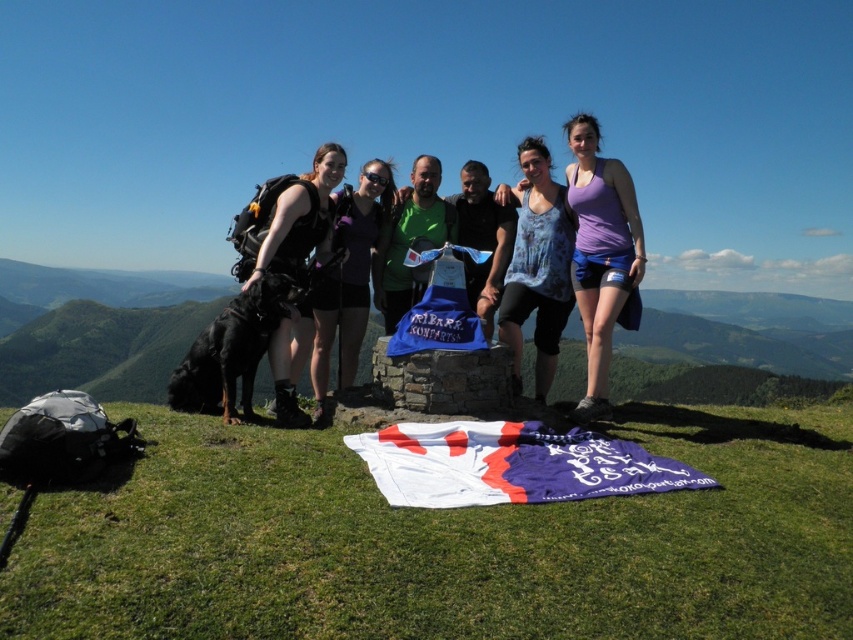
Question: Is purple fabric at center above matte black backpack at center?

Choices:
 (A) yes
 (B) no

Answer: (A)

Question: Which object is closer to the camera taking this photo?

Choices:
 (A) blue tie-dye tank top at center
 (B) white fabric banner at center
 (C) blue fabric at center

Answer: (B)

Question: Is the position of blue tie-dye tank top at center less distant than that of matte black backpack at center?

Choices:
 (A) no
 (B) yes

Answer: (A)

Question: Can you confirm if matte black backpack at left is smaller than blue fabric at center?

Choices:
 (A) no
 (B) yes

Answer: (A)

Question: Which point is closer to the camera taking this photo?

Choices:
 (A) (601, 307)
 (B) (430, 440)
 (C) (286, 269)

Answer: (B)

Question: Which point is closer to the camera taking this photo?

Choices:
 (A) (392, 336)
 (B) (621, 296)
 (C) (381, 195)
 (D) (283, 237)

Answer: (B)